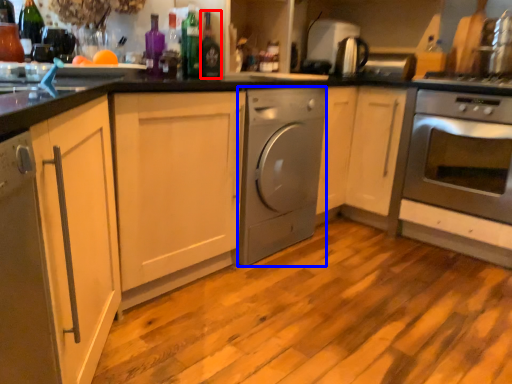
Question: Among these objects, which one is nearest to the camera, bottle (highlighted by a red box) or home appliance (highlighted by a blue box)?

Choices:
 (A) bottle
 (B) home appliance

Answer: (A)